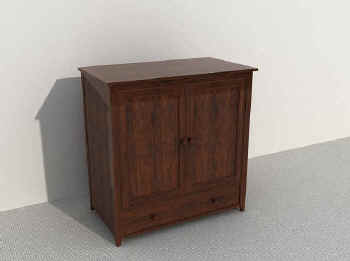
Image resolution: width=350 pixels, height=261 pixels. Identify the location of right door. (207, 140).